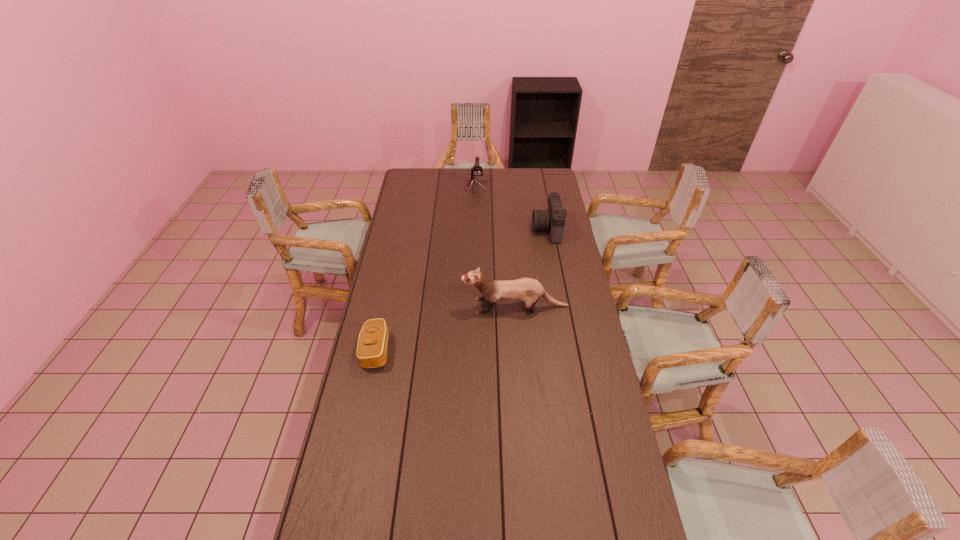
The height and width of the screenshot is (540, 960). I want to click on free space between the leftmost object and the ferret, so click(x=445, y=328).

Locate which object ranks in proximity to the third nearest object. Please provide its 2D coordinates. Your answer should be formatted as a tuple, i.e. [(x, y)], where the tuple contains the x and y coordinates of a point satisfying the conditions above.

[(476, 171)]

Identify the location of object that is the closest to the third farthest object. (372, 347).

This screenshot has height=540, width=960. Identify the location of vacant position in the image that satisfies the following two spatial constraints: 1. on the front side of the farthest object; 2. on the zipper side of the leftmost object. (472, 350).